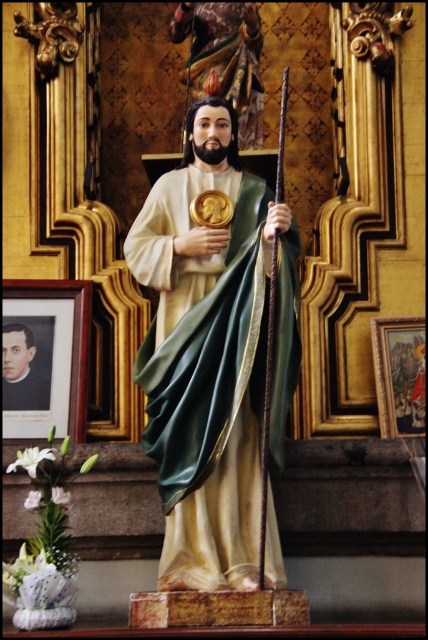
Question: Which point is closer to the camera?

Choices:
 (A) pos(27,385)
 (B) pos(243,257)

Answer: (B)

Question: Which of the following is the closest to the observer?

Choices:
 (A) smooth black portrait at lower left
 (B) green satin robe at center

Answer: (B)

Question: Does green satin robe at center appear under smooth black portrait at lower left?

Choices:
 (A) no
 (B) yes

Answer: (A)

Question: Which object appears closest to the camera in this image?

Choices:
 (A) green satin robe at center
 (B) smooth black portrait at lower left

Answer: (A)

Question: Does green satin robe at center appear over smooth black portrait at lower left?

Choices:
 (A) yes
 (B) no

Answer: (A)

Question: Where is green satin robe at center located in relation to smooth black portrait at lower left in the image?

Choices:
 (A) right
 (B) left

Answer: (A)